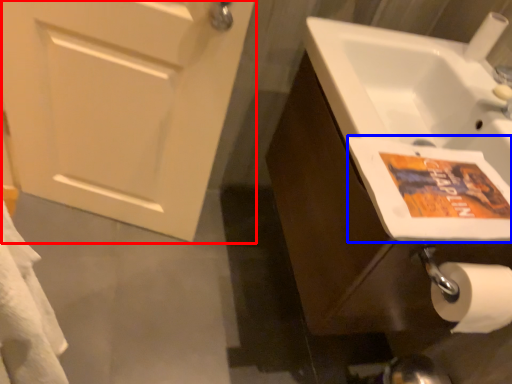
Question: Which of the following is the closest to the observer, door (highlighted by a red box) or flyer (highlighted by a blue box)?

Choices:
 (A) door
 (B) flyer

Answer: (B)